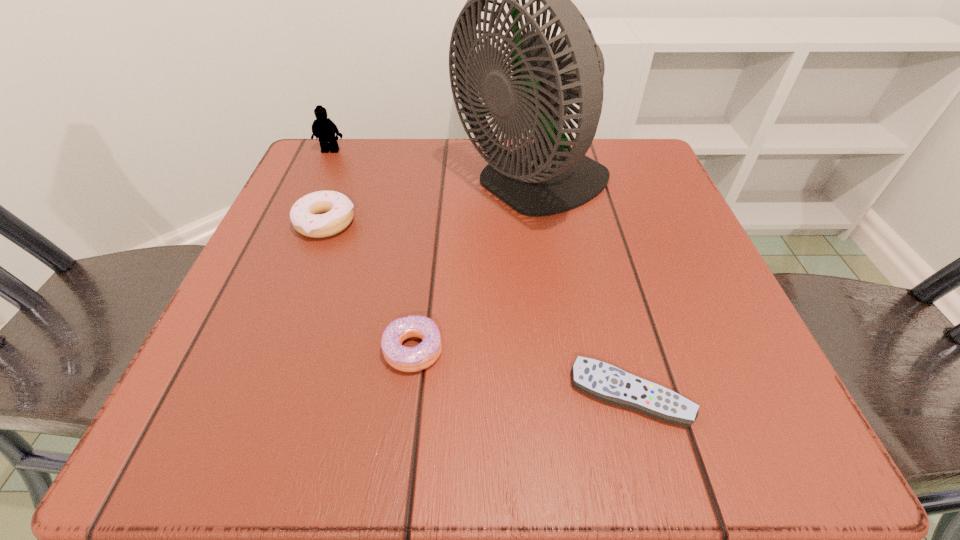
Identify the location of fan. Image resolution: width=960 pixels, height=540 pixels. (546, 177).

At what (x,y) coordinates should I click in order to perform the action: click on Lego. Please return your answer as a coordinate pair (x, y). Image resolution: width=960 pixels, height=540 pixels. Looking at the image, I should click on (323, 128).

You are a GUI agent. You are given a task and a screenshot of the screen. Output one action in this format:
    pyautogui.click(x=<x>, y=<y>)
    Task: Click on the farther doughnut
    
    Given the screenshot: What is the action you would take?
    pyautogui.click(x=305, y=216)

Image resolution: width=960 pixels, height=540 pixels. In order to click on the right doughnut in this screenshot , I will do `click(407, 359)`.

I want to click on remote control, so pyautogui.click(x=603, y=381).

At what (x,y) coordinates should I click in order to perform the action: click on free location located 0.050m in front of the tallest object to direct airflow. Please return your answer as a coordinate pair (x, y). This screenshot has width=960, height=540. Looking at the image, I should click on (427, 187).

In order to click on vacant space located 0.090m in front of the tallest object to direct airflow in this screenshot , I will do `click(407, 187)`.

In order to click on free space located 0.240m in front of the tallest object to direct airflow in this screenshot , I will do `click(330, 187)`.

Find the location of `vacant space situated on the face of the second tallest object`. vacant space situated on the face of the second tallest object is located at coordinates pos(291,239).

Identify the location of vacant space located on the right of the farther doughnut. (495, 222).